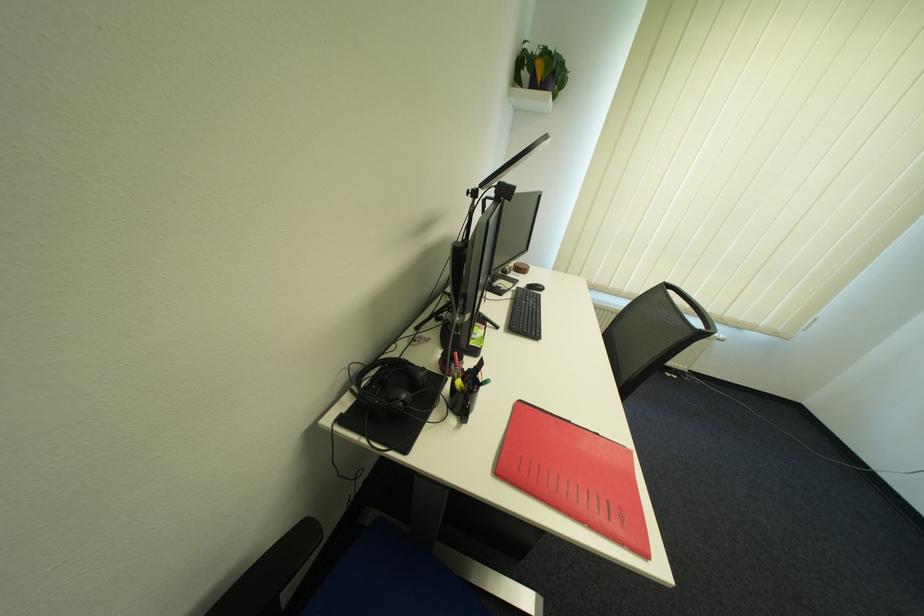
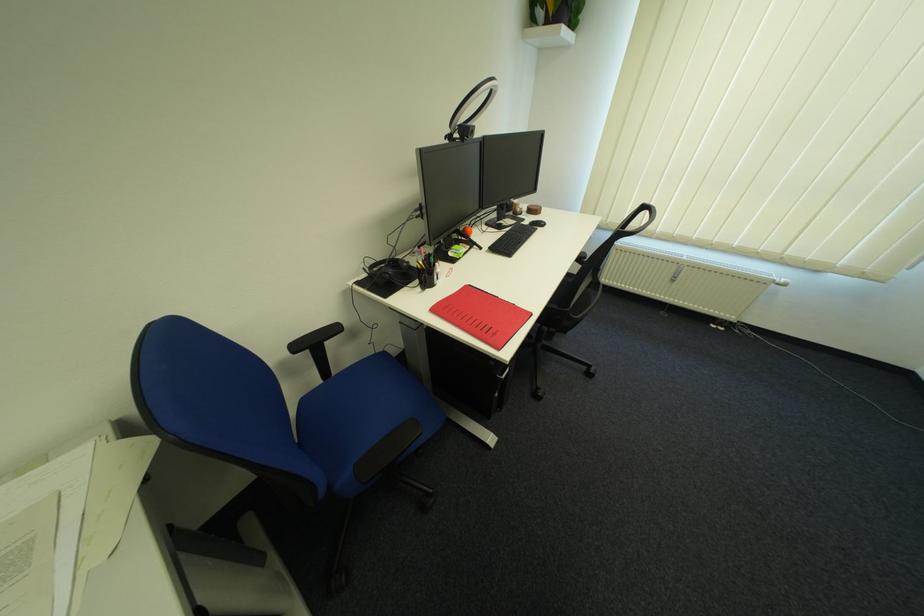
Locate, in the second image, the point that corresponds to point 501,193 in the first image.

(467, 136)